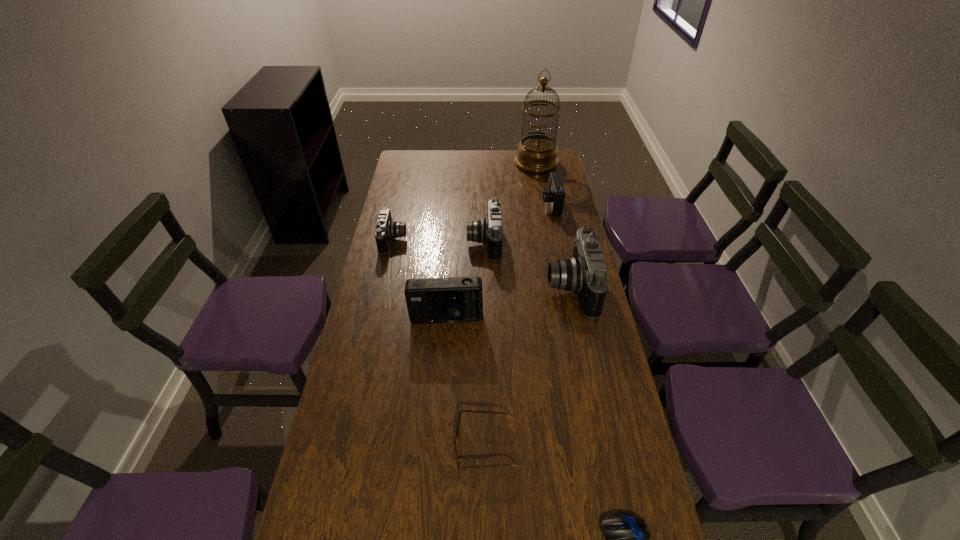
The height and width of the screenshot is (540, 960). Identify the location of the smallest black camera. (386, 229).

Locate an element on the screen. The height and width of the screenshot is (540, 960). sunglasses is located at coordinates (x=459, y=417).

Identify the location of the second shortest object. This screenshot has width=960, height=540. (459, 417).

The height and width of the screenshot is (540, 960). I want to click on vacant space located with an open door on the tallest object, so click(x=543, y=202).

This screenshot has width=960, height=540. In order to click on vacant point located 0.170m on the front-facing side of the biggest black camera in this screenshot , I will do `click(498, 288)`.

The height and width of the screenshot is (540, 960). I want to click on vacant region located 0.150m on the front-facing side of the biggest black camera, so click(x=504, y=288).

Image resolution: width=960 pixels, height=540 pixels. I want to click on vacant region located 0.400m on the front-facing side of the biggest black camera, so click(x=432, y=288).

This screenshot has width=960, height=540. Identify the location of vacant region located 0.210m on the front-facing side of the left blue camera. (441, 393).

At what (x,y) coordinates should I click in order to perform the action: click on free space located on the front-facing side of the second black camera from right to left. Please return your answer as a coordinate pair (x, y). The width and height of the screenshot is (960, 540). Looking at the image, I should click on (400, 242).

Where is `free space located on the front-facing side of the second black camera from right to left`? free space located on the front-facing side of the second black camera from right to left is located at coordinates (446, 242).